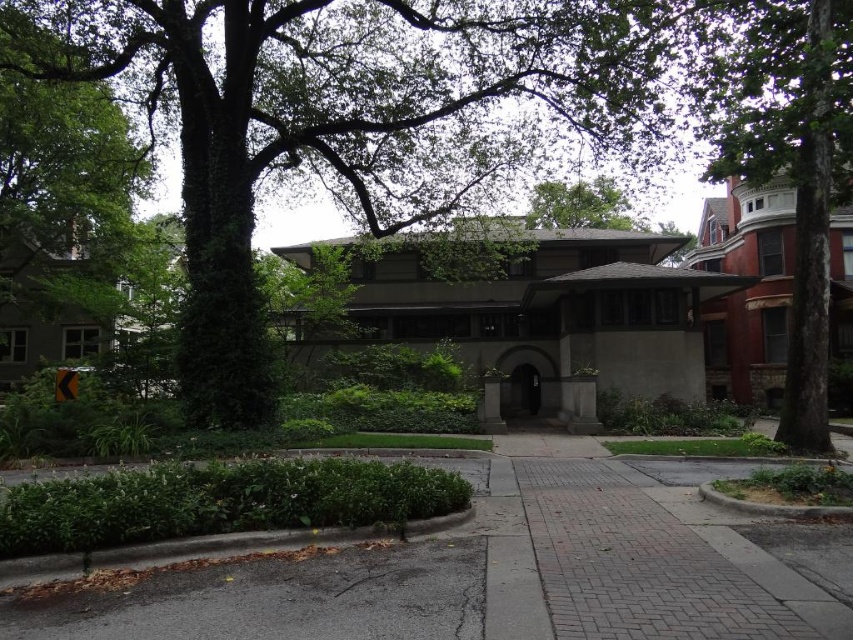
Consider the image. You are planning to install a new light pole in this residential area. The light pole needs to be placed where it won not block the view of the house from the sidewalk. Considering the green leafy tree at center and the brick paved sidewalk at center, which object should the light pole be placed closer to?

The light pole should be placed closer to the brick paved sidewalk at center because the green leafy tree at center is much taller and could block the view if the pole were placed near it.

You are standing at the entrance of the house and want to walk to the brick pavement at center. Which direction should you go from the brick paved sidewalk at center?

The brick pavement at center is to the left of the brick paved sidewalk at center, so you should go left from the brick paved sidewalk at center to reach the brick pavement at center.

You are a gardener planning to plant a new tree in the residential area. You notice the brick paved sidewalk at center and the green leafy tree at upper center. Which object is shorter in height?

The brick paved sidewalk at center is shorter than the green leafy tree at upper center, so the brick paved sidewalk at center is shorter in height.